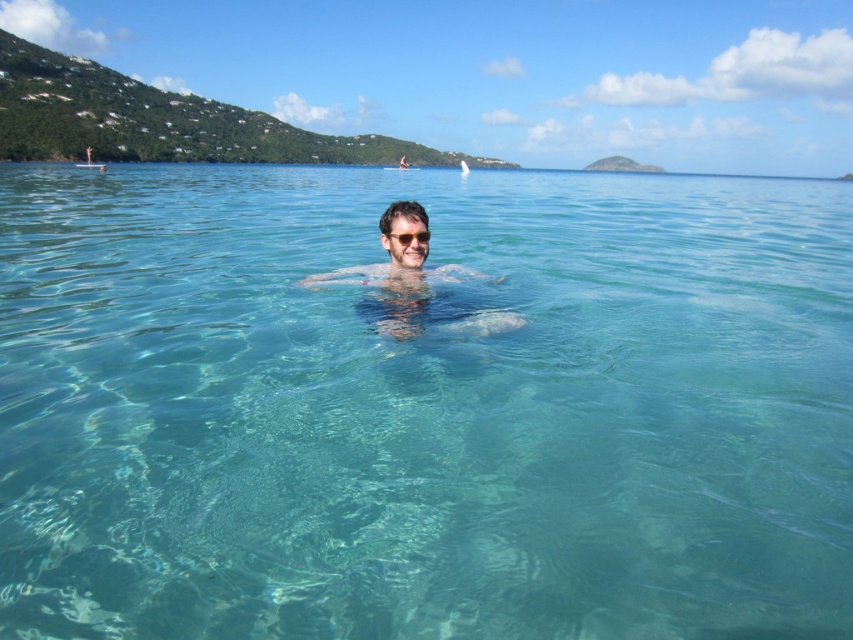
You are a lifeguard on duty and need to monitor the clear water at center and the matte skin at center. According to the scene, which object is closer to the surface of the water?

The clear water at center is located above matte skin at center, so it is closer to the surface of the water.